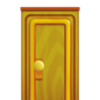
Where is `door knob`? The height and width of the screenshot is (100, 100). door knob is located at coordinates (38, 66).